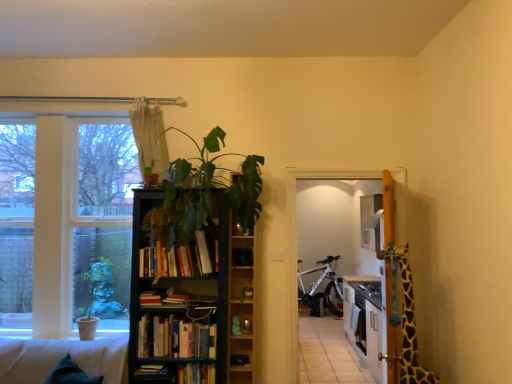
Question: Considering the relative sizes of beige fabric curtain at upper center and waffle-textured white couch at lower left in the image provided, is beige fabric curtain at upper center bigger than waffle-textured white couch at lower left?

Choices:
 (A) yes
 (B) no

Answer: (B)

Question: From a real-world perspective, is beige fabric curtain at upper center on waffle-textured white couch at lower left?

Choices:
 (A) yes
 (B) no

Answer: (A)

Question: Considering the relative positions of beige fabric curtain at upper center and waffle-textured white couch at lower left in the image provided, is beige fabric curtain at upper center in front of waffle-textured white couch at lower left?

Choices:
 (A) no
 (B) yes

Answer: (A)

Question: Can waffle-textured white couch at lower left be found inside beige fabric curtain at upper center?

Choices:
 (A) no
 (B) yes

Answer: (A)

Question: Can you confirm if beige fabric curtain at upper center is smaller than waffle-textured white couch at lower left?

Choices:
 (A) no
 (B) yes

Answer: (B)

Question: From a real-world perspective, relative to white matte bicycle at center, is dark wood bookcase at center vertically above or below?

Choices:
 (A) above
 (B) below

Answer: (A)

Question: Considering the positions of dark wood bookcase at center and white matte bicycle at center in the image, is dark wood bookcase at center taller or shorter than white matte bicycle at center?

Choices:
 (A) short
 (B) tall

Answer: (B)

Question: Is dark wood bookcase at center bigger or smaller than white matte bicycle at center?

Choices:
 (A) small
 (B) big

Answer: (A)

Question: Is dark wood bookcase at center inside or outside of white matte bicycle at center?

Choices:
 (A) outside
 (B) inside

Answer: (A)

Question: Looking at their shapes, would you say hardcover book at center, which is the 1th book in bottom-to-top order, is wider or thinner than beige fabric curtain at upper center?

Choices:
 (A) thin
 (B) wide

Answer: (B)

Question: Considering the positions of hardcover book at center, which is the 1th book in bottom-to-top order, and beige fabric curtain at upper center in the image, is hardcover book at center, which is the 1th book in bottom-to-top order, bigger or smaller than beige fabric curtain at upper center?

Choices:
 (A) big
 (B) small

Answer: (B)

Question: From the image's perspective, is hardcover book at center, which is counted as the 4th book, starting from the top, above or below beige fabric curtain at upper center?

Choices:
 (A) above
 (B) below

Answer: (B)

Question: From a real-world perspective, is hardcover book at center, which is counted as the 4th book, starting from the top, above or below beige fabric curtain at upper center?

Choices:
 (A) below
 (B) above

Answer: (A)

Question: Relative to dark wood bookcase at center, is hardcover book at center, arranged as the third book when viewed from the top, in front or behind?

Choices:
 (A) behind
 (B) front

Answer: (A)

Question: Is point (194, 380) closer or farther from the camera than point (243, 360)?

Choices:
 (A) farther
 (B) closer

Answer: (B)